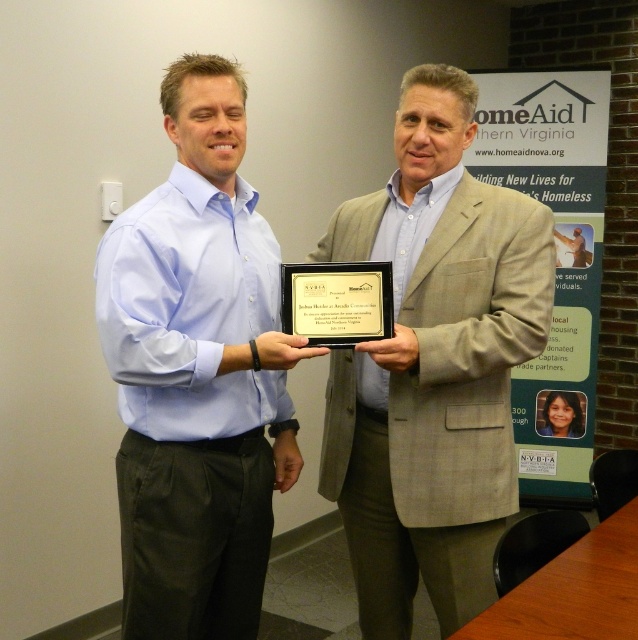
Question: Among these points, which one is farthest from the camera?

Choices:
 (A) (433, 285)
 (B) (234, 628)
 (C) (313, 289)

Answer: (B)

Question: Which of the following is the closest to the observer?

Choices:
 (A) (461, 461)
 (B) (198, 632)

Answer: (B)

Question: Is light brown textured blazer at center positioned in front of light blue shirt at center?

Choices:
 (A) no
 (B) yes

Answer: (A)

Question: Which point is closer to the camera?

Choices:
 (A) (329, 266)
 (B) (450, 260)

Answer: (A)

Question: Does light blue shirt at center have a greater width compared to black plastic plaque at center?

Choices:
 (A) yes
 (B) no

Answer: (A)

Question: Does light brown textured blazer at center have a larger size compared to black plastic plaque at center?

Choices:
 (A) yes
 (B) no

Answer: (A)